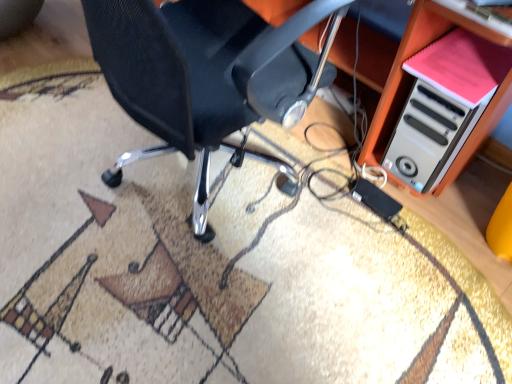
Measure the distance between white plastic computer case at lower right and camera.

white plastic computer case at lower right is 91.14 centimeters from camera.

Where is `pink matte book at upper right`? Image resolution: width=512 pixels, height=384 pixels. pink matte book at upper right is located at coordinates (462, 66).

This screenshot has width=512, height=384. Identify the location of black mesh chair at center. (206, 74).

Which of these two, pink matte book at upper right or black mesh chair at center, is bigger?

With larger size is black mesh chair at center.

Could you tell me if pink matte book at upper right is facing black mesh chair at center?

No, pink matte book at upper right is not oriented towards black mesh chair at center.

Considering the sizes of objects pink matte book at upper right and black mesh chair at center in the image provided, who is thinner, pink matte book at upper right or black mesh chair at center?

pink matte book at upper right is thinner.

From the picture: Can you confirm if pink matte book at upper right is positioned to the right of white plastic computer tower at right?

Yes.

Can you confirm if pink matte book at upper right is bigger than white plastic computer tower at right?

Actually, pink matte book at upper right might be smaller than white plastic computer tower at right.

Is pink matte book at upper right turned away from white plastic computer tower at right?

That's not correct — pink matte book at upper right is not looking away from white plastic computer tower at right.

From the image's perspective, is pink matte book at upper right above or below white plastic computer tower at right?

pink matte book at upper right is situated higher than white plastic computer tower at right in the image.

From the picture: Considering their positions, is white plastic computer tower at right located in front of or behind black mesh chair at center?

In the image, white plastic computer tower at right appears behind black mesh chair at center.

How different are the orientations of white plastic computer tower at right and black mesh chair at center in degrees?

177 degrees.

From a real-world perspective, is white plastic computer tower at right over black mesh chair at center?

No.

The image size is (512, 384). I want to click on chair lying in front of the white plastic computer tower at right, so click(206, 74).

How many degrees apart are the facing directions of white plastic computer case at lower right and white plastic computer tower at right?

4.13 degrees separate the facing orientations of white plastic computer case at lower right and white plastic computer tower at right.

Relative to white plastic computer tower at right, is white plastic computer case at lower right in front or behind?

Clearly, white plastic computer case at lower right is in front of white plastic computer tower at right.

From the picture: Is white plastic computer case at lower right looking in the opposite direction of white plastic computer tower at right?

white plastic computer case at lower right is not turned away from white plastic computer tower at right.

Considering the points (372, 81) and (402, 133), which point is in front, point (372, 81) or point (402, 133)?

The point (402, 133) is in front.

From a real-world perspective, is white plastic computer case at lower right positioned over pink matte book at upper right based on gravity?

No, from a real-world perspective, white plastic computer case at lower right is not over pink matte book at upper right

From the image's perspective, is white plastic computer case at lower right on pink matte book at upper right?

Yes, from the image's perspective, white plastic computer case at lower right is on top of pink matte book at upper right.

Is point (374, 54) closer or farther from the camera than point (495, 68)?

Clearly, point (374, 54) is more distant from the camera than point (495, 68).

Is pink matte book at upper right far from white plastic computer case at lower right?

No, pink matte book at upper right is not far from white plastic computer case at lower right.

Considering the sizes of objects pink matte book at upper right and white plastic computer case at lower right in the image provided, who is bigger, pink matte book at upper right or white plastic computer case at lower right?

Result: white plastic computer case at lower right.

From the image's perspective, does pink matte book at upper right appear lower than white plastic computer case at lower right?

Yes.

Which is more to the left, pink matte book at upper right or white plastic computer case at lower right?

white plastic computer case at lower right is more to the left.

Is black mesh chair at center in front of or behind white plastic computer tower at right in the image?

black mesh chair at center is positioned closer to the viewer than white plastic computer tower at right.

From a real-world perspective, who is located lower, black mesh chair at center or white plastic computer tower at right?

In real-world perspective, white plastic computer tower at right is lower.

Is white plastic computer tower at right a part of black mesh chair at center?

Definitely not — white plastic computer tower at right is not inside black mesh chair at center.

Between black mesh chair at center and white plastic computer tower at right, which one has smaller size?

white plastic computer tower at right is smaller.

Where is `chair in front of the pink matte book at upper right`? This screenshot has width=512, height=384. chair in front of the pink matte book at upper right is located at coordinates (206, 74).

Identify the location of computer tower lying on the left of pink matte book at upper right. This screenshot has width=512, height=384. (428, 136).

From the image, which object appears to be farther from white plastic computer tower at right, pink matte book at upper right or white plastic computer case at lower right?

pink matte book at upper right is further to white plastic computer tower at right.

Considering their positions, is white plastic computer tower at right positioned closer to white plastic computer case at lower right than black mesh chair at center?

white plastic computer tower at right is closer to white plastic computer case at lower right.

Considering their positions, is pink matte book at upper right positioned further to black mesh chair at center than white plastic computer tower at right?

Based on the image, pink matte book at upper right appears to be further to black mesh chair at center.

Looking at the image, which one is located further to white plastic computer tower at right, pink matte book at upper right or black mesh chair at center?

black mesh chair at center is positioned further to the anchor white plastic computer tower at right.

From the picture: When comparing their distances from white plastic computer tower at right, does white plastic computer case at lower right or pink matte book at upper right seem closer?

white plastic computer case at lower right is closer to white plastic computer tower at right.

Estimate the real-world distances between objects in this image. Which object is further from pink matte book at upper right, white plastic computer tower at right or black mesh chair at center?

black mesh chair at center lies further to pink matte book at upper right than the other object.

From the picture: Looking at the image, which one is located further to pink matte book at upper right, black mesh chair at center or white plastic computer case at lower right?

The object further to pink matte book at upper right is black mesh chair at center.

Which object lies nearer to the anchor point white plastic computer tower at right, white plastic computer case at lower right or black mesh chair at center?

Among the two, white plastic computer case at lower right is located nearer to white plastic computer tower at right.

I want to click on computer desk situated between black mesh chair at center and pink matte book at upper right from left to right, so (x=403, y=62).

I want to click on book between white plastic computer case at lower right and white plastic computer tower at right along the z-axis, so click(462, 66).

This screenshot has width=512, height=384. I want to click on computer desk situated between black mesh chair at center and white plastic computer tower at right from left to right, so click(403, 62).

Where is `computer tower situated between black mesh chair at center and pink matte book at upper right from left to right`? computer tower situated between black mesh chair at center and pink matte book at upper right from left to right is located at coordinates (428, 136).